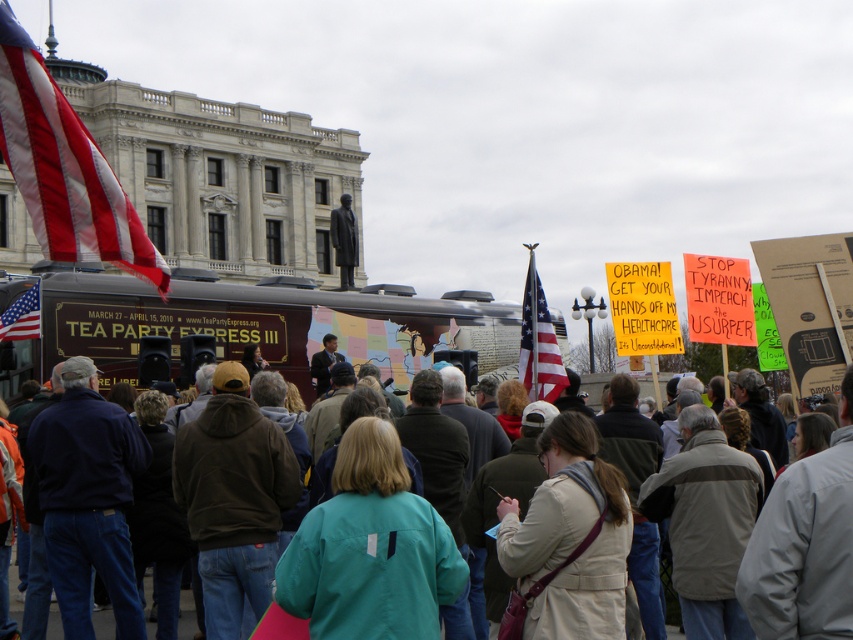
Does red-white-blue fabric flag at upper left have a lesser height compared to green fabric jacket at center?

Incorrect, red-white-blue fabric flag at upper left's height does not fall short of green fabric jacket at center's.

Which is in front, point (122, 268) or point (18, 609)?

Point (18, 609) is more forward.

Which is behind, point (45, 186) or point (100, 612)?

Point (100, 612)

The image size is (853, 640). I want to click on red-white-blue fabric flag at upper left, so click(64, 168).

Is brown vinyl food truck at center below tan leather jacket at center?

No, brown vinyl food truck at center is not below tan leather jacket at center.

Where is `brown vinyl food truck at center`? Image resolution: width=853 pixels, height=640 pixels. brown vinyl food truck at center is located at coordinates (251, 326).

The height and width of the screenshot is (640, 853). What are the coordinates of `brown vinyl food truck at center` in the screenshot? It's located at (251, 326).

Which is above, brown vinyl food truck at center or american flag at left?

brown vinyl food truck at center is above.

Can you confirm if brown vinyl food truck at center is positioned to the right of american flag at left?

Correct, you'll find brown vinyl food truck at center to the right of american flag at left.

This screenshot has width=853, height=640. What are the coordinates of `brown vinyl food truck at center` in the screenshot? It's located at (251, 326).